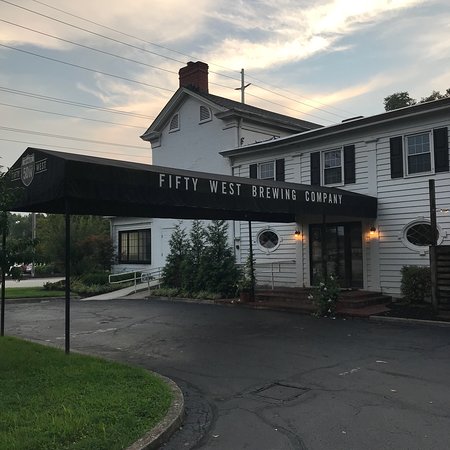
Locate an element on the screen. chimney is located at coordinates (192, 81).